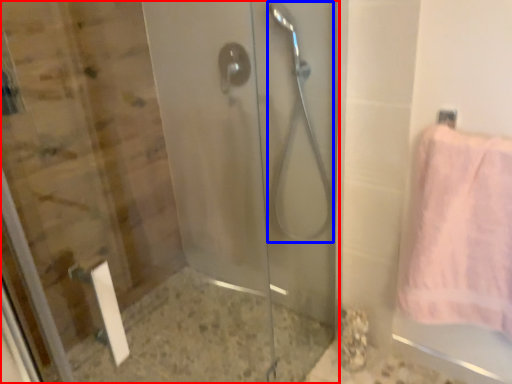
Question: Which object appears closest to the camera in this image, screen door (highlighted by a red box) or shower (highlighted by a blue box)?

Choices:
 (A) screen door
 (B) shower

Answer: (A)